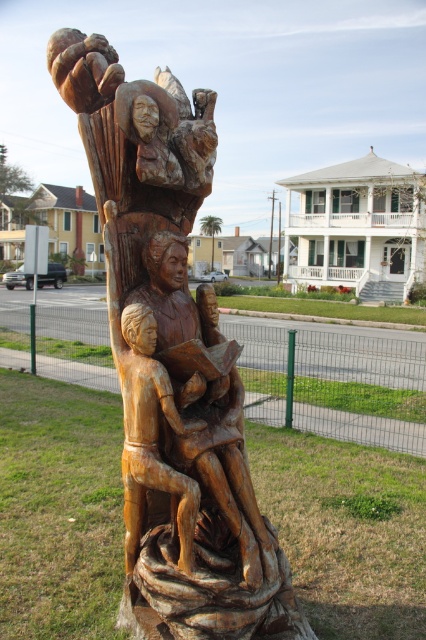
You are a painter standing 10 feet away from the wooden carving at center and the light brown wood carving of person at center. You want to paint both figures but can only reach up to 6 inches. Can you paint both without moving closer?

The distance between the wooden carving at center and the light brown wood carving of person at center is 5.65 inches. Since your reach is 6 inches, you can paint both figures without moving closer as the distance is within your reach.

You are a visitor standing in front of the wooden sculpture. You notice two figures in the sculpture. One is the natural wood carving at center, and the other is the light brown wood carving of person at center. Which figure is located higher up in the sculpture?

The natural wood carving at center is positioned over the light brown wood carving of person at center, so the natural wood carving at center is higher up in the sculpture.